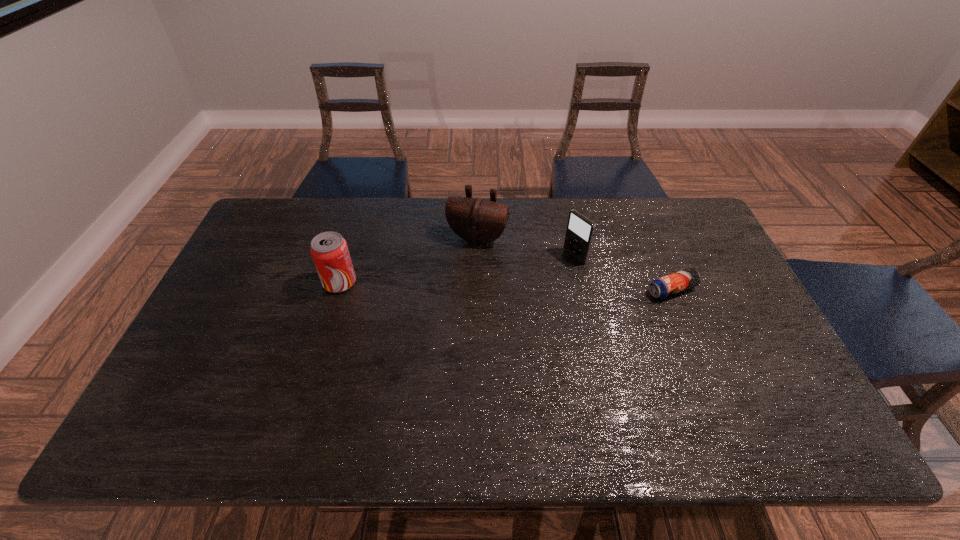
This screenshot has width=960, height=540. I want to click on vacant space located with the flap open on the second object from left to right, so click(x=459, y=271).

Find the location of `blank space located 0.340m with the flap open on the second object from left to right`. blank space located 0.340m with the flap open on the second object from left to right is located at coordinates [433, 329].

Locate an element on the screen. The image size is (960, 540). blank space located 0.140m with the flap open on the second object from left to right is located at coordinates (455, 278).

Where is `object located at the far edge`? This screenshot has height=540, width=960. object located at the far edge is located at coordinates (476, 220).

The width and height of the screenshot is (960, 540). I want to click on object located at the right edge, so click(668, 285).

Locate an element on the screen. This screenshot has width=960, height=540. vacant space at the far edge is located at coordinates (396, 230).

This screenshot has width=960, height=540. Identify the location of vacant space at the near edge. (701, 405).

In the image, there is a desktop. Find the location of `blank space at the right edge`. blank space at the right edge is located at coordinates (696, 261).

At what (x,y) coordinates should I click in order to perform the action: click on vacant point located between the shortest object and the soda can. Please return your answer as a coordinate pair (x, y). This screenshot has height=540, width=960. Looking at the image, I should click on (506, 286).

The image size is (960, 540). I want to click on empty space that is in between the leftmost object and the second object from right to left, so click(x=457, y=269).